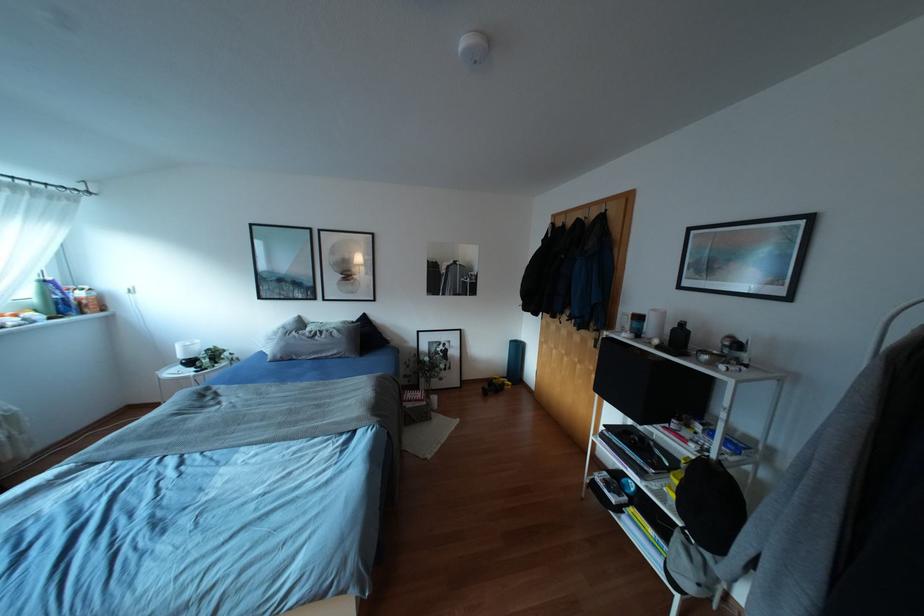
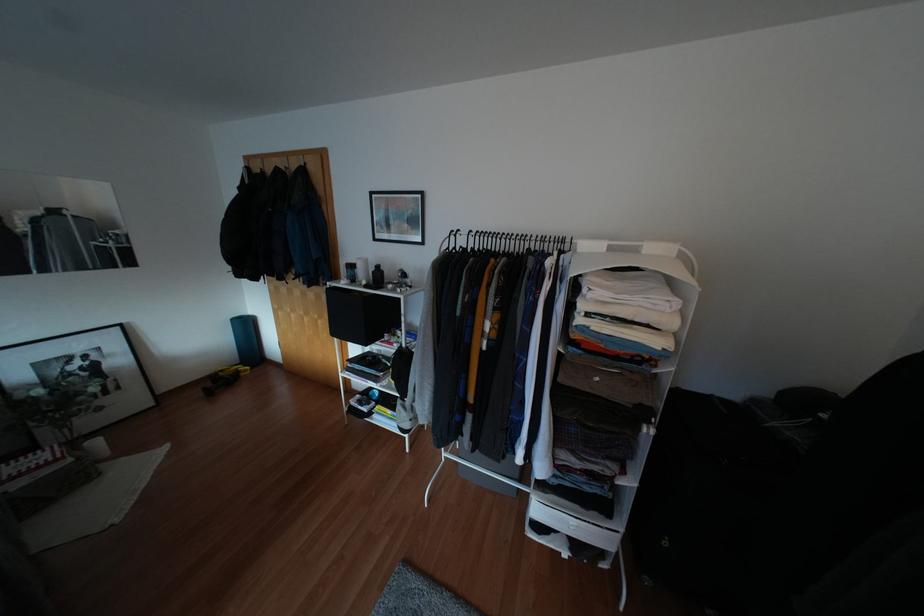
Where in the second image is the point corresponding to point 682,323 from the first image?

(377, 265)